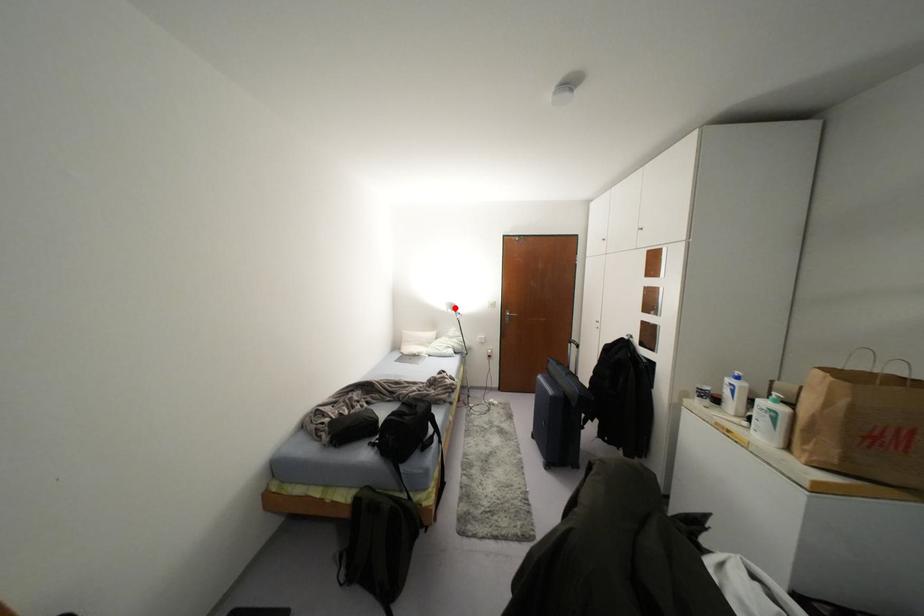
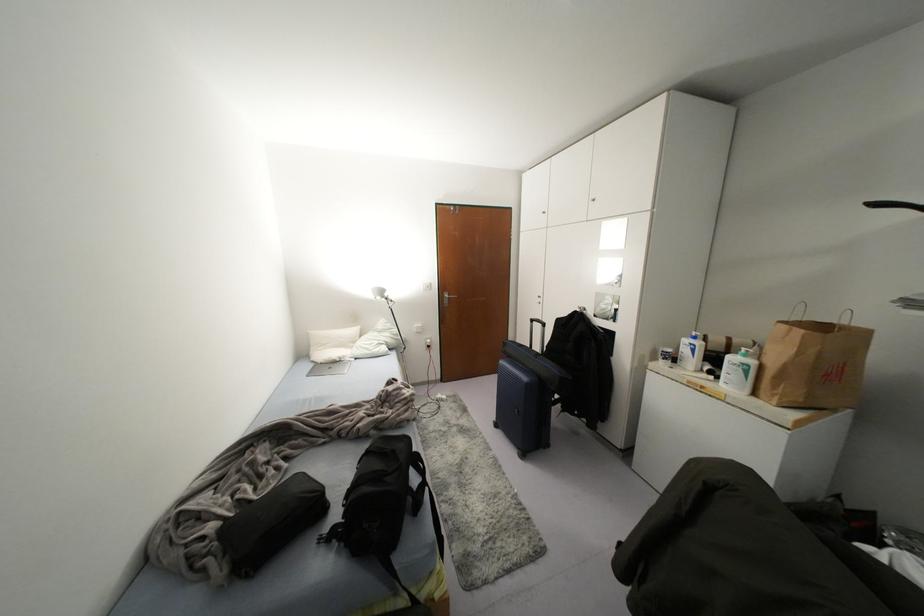
Where in the second image is the point corresponding to the highlighted location from the first image?

(385, 294)